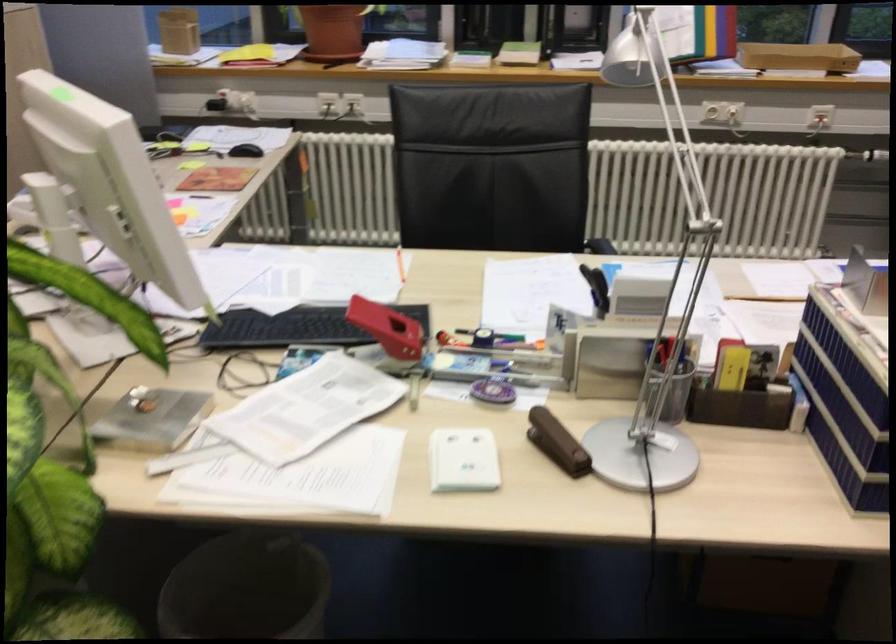
The width and height of the screenshot is (896, 644). What do you see at coordinates (556, 442) in the screenshot? I see `a brown stapler top` at bounding box center [556, 442].